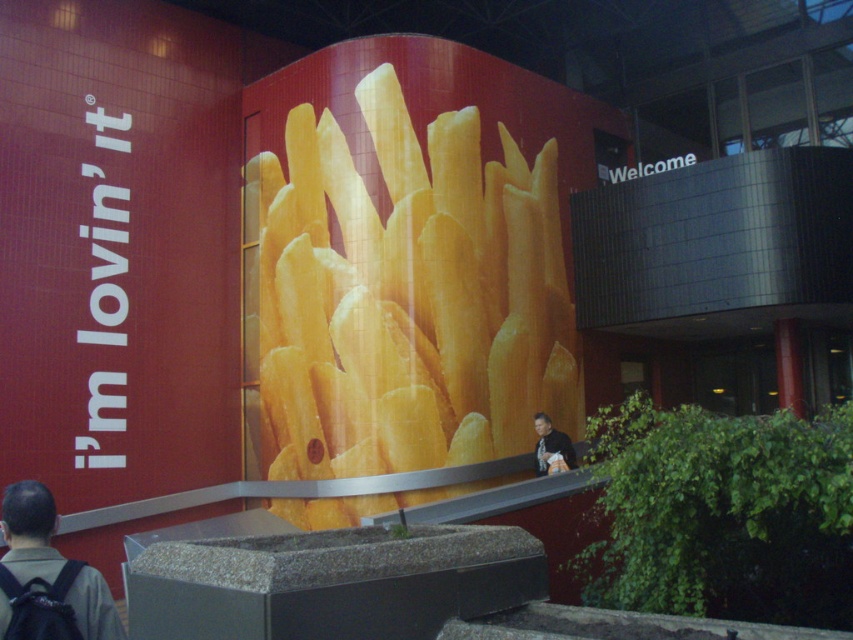
You are a delivery person who needs to place a dark gray backpack at lower left and a light brown leather jacket at lower center onto a shelf. The shelf has limited space. Based on the image, which item should you place first to ensure both fit properly?

The dark gray backpack at lower left is positioned over light brown leather jacket at lower center, so you should place the light brown leather jacket at lower center first to make space for the backpack on top.

You are a delivery person standing at the entrance of the building. You need to place your dark gray backpack at lower left next to the golden crispy french fries at center. Is there enough space for both items to fit side by side?

The golden crispy french fries at center might be wider than dark gray backpack at lower left, so there may not be enough space for both items to fit side by side.

You are a delivery person who needs to place a small package on a surface that can hold it securely. You see the dark gray backpack at lower left and the light brown leather jacket at lower center. Which object is shorter and therefore more likely to provide a stable base for the package?

The dark gray backpack at lower left is not as tall as the light brown leather jacket at lower center, making it shorter and thus more stable for placing the package.